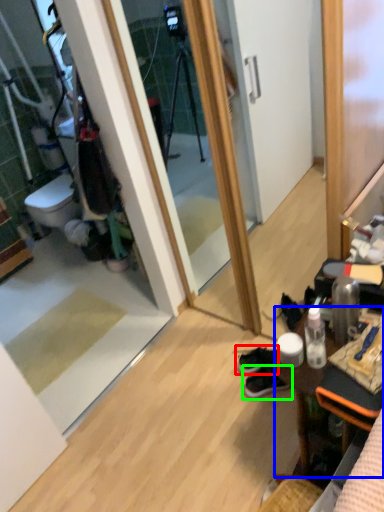
Question: Which object is positioned closest to footwear (highlighted by a red box)? Select from desk (highlighted by a blue box) and footwear (highlighted by a green box).

Choices:
 (A) desk
 (B) footwear

Answer: (B)